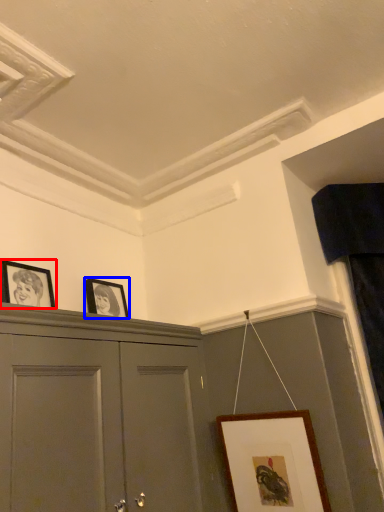
Question: Which of the following is the closest to the observer, picture frame (highlighted by a red box) or picture frame (highlighted by a blue box)?

Choices:
 (A) picture frame
 (B) picture frame

Answer: (A)